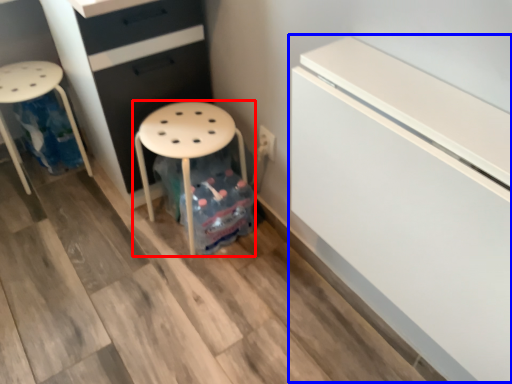
Question: Which object appears closest to the camera in this image, stool (highlighted by a red box) or fridge (highlighted by a blue box)?

Choices:
 (A) stool
 (B) fridge

Answer: (B)